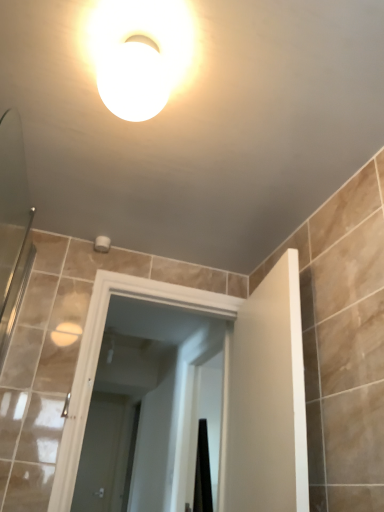
Question: Which direction should I rotate to look at white glossy door at center, acting as the 1th screen door starting from the bottom?

Choices:
 (A) left
 (B) right

Answer: (A)

Question: From the image's perspective, is white glossy door at center, the 1th screen door when ordered from front to back, beneath white glossy door at center, which is the first screen door in left-to-right order?

Choices:
 (A) no
 (B) yes

Answer: (A)

Question: Can we say white glossy door at center, marked as the 2th screen door in a left-to-right arrangement, lies outside white glossy door at center, the second screen door positioned from the right?

Choices:
 (A) yes
 (B) no

Answer: (A)

Question: Can you confirm if white glossy door at center, positioned as the 2th screen door in bottom-to-top order, is wider than white glossy door at center, acting as the 1th screen door starting from the bottom?

Choices:
 (A) yes
 (B) no

Answer: (A)

Question: Is white glossy door at center, marked as the first screen door in a top-to-bottom arrangement, taller than white glossy door at center, the second screen door positioned from the right?

Choices:
 (A) no
 (B) yes

Answer: (A)

Question: Does white glossy door at center, acting as the second screen door starting from the back, appear on the right side of white glossy door at center, acting as the 1th screen door starting from the bottom?

Choices:
 (A) yes
 (B) no

Answer: (A)

Question: Does white glossy door at center, the 1th screen door when ordered from front to back, have a smaller size compared to white glossy door at center, the second screen door positioned from the right?

Choices:
 (A) yes
 (B) no

Answer: (B)

Question: From the image's perspective, is white glossy door at center, the second screen door positioned from the right, over white glossy light fixture at upper center?

Choices:
 (A) no
 (B) yes

Answer: (A)

Question: Does white glossy door at center, the second screen door positioned from the right, have a lesser height compared to white glossy light fixture at upper center?

Choices:
 (A) no
 (B) yes

Answer: (A)

Question: Does white glossy door at center, which is the first screen door in left-to-right order, turn towards white glossy light fixture at upper center?

Choices:
 (A) yes
 (B) no

Answer: (A)

Question: From the image's perspective, is white glossy door at center, which is the first screen door in left-to-right order, located beneath white glossy light fixture at upper center?

Choices:
 (A) yes
 (B) no

Answer: (A)

Question: Can you confirm if white glossy door at center, the second screen door positioned from the right, is wider than white glossy light fixture at upper center?

Choices:
 (A) yes
 (B) no

Answer: (B)

Question: Is white glossy door at center, which is counted as the 2th screen door, starting from the front, turned away from white glossy light fixture at upper center?

Choices:
 (A) yes
 (B) no

Answer: (B)

Question: Does white glossy door at center, which is the first screen door in left-to-right order, have a greater width compared to white glossy door at center, the 1th screen door from the right?

Choices:
 (A) no
 (B) yes

Answer: (A)